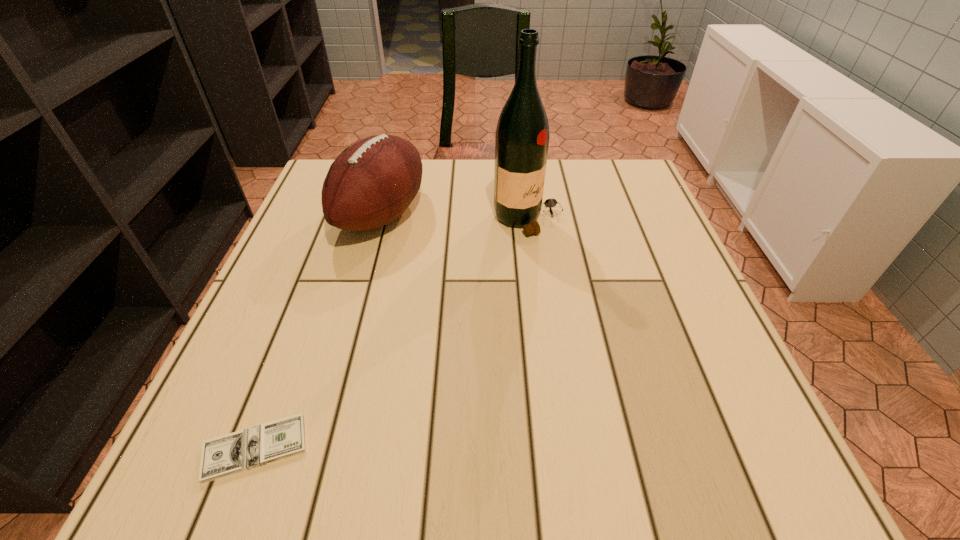
Where is `free space between the football (American) and the wine bottle`? The width and height of the screenshot is (960, 540). free space between the football (American) and the wine bottle is located at coordinates (455, 218).

Find the location of a particular element. free space between the football (American) and the wine bottle is located at coordinates click(x=455, y=218).

Locate an element on the screen. The image size is (960, 540). vacant region between the second tallest object and the tallest object is located at coordinates (x=455, y=218).

You are a GUI agent. You are given a task and a screenshot of the screen. Output one action in this format:
    pyautogui.click(x=<x>, y=<y>)
    Task: Click on the unoccupied area between the tallest object and the shortest object
    
    Given the screenshot: What is the action you would take?
    pyautogui.click(x=392, y=334)

Locate an element on the screen. The width and height of the screenshot is (960, 540). vacant area between the dollar and the football (American) is located at coordinates (319, 332).

Find the location of a particular element. The image size is (960, 540). vacant point located between the rightmost object and the nearest object is located at coordinates (392, 334).

The height and width of the screenshot is (540, 960). Identify the location of vacant space that's between the tallest object and the nearest object. (392, 334).

Image resolution: width=960 pixels, height=540 pixels. I want to click on free space between the rightmost object and the second shortest object, so click(455, 218).

At what (x,y) coordinates should I click in order to perform the action: click on empty space between the shortest object and the wine bottle. Please return your answer as a coordinate pair (x, y). This screenshot has height=540, width=960. Looking at the image, I should click on (x=392, y=334).

Find the location of a particular element. free space that is in between the tallest object and the football (American) is located at coordinates (455, 218).